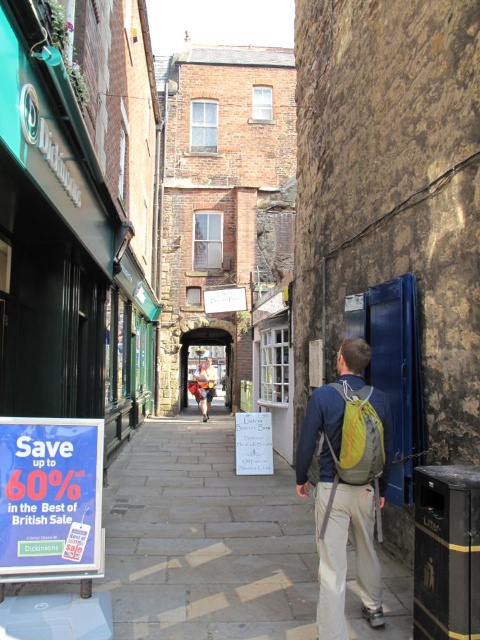
Is blue paper sign at lower left bigger than camouflage shorts at center?

No, blue paper sign at lower left is not bigger than camouflage shorts at center.

Measure the distance between blue paper sign at lower left and camouflage shorts at center.

blue paper sign at lower left and camouflage shorts at center are 52.81 feet apart.

Image resolution: width=480 pixels, height=640 pixels. I want to click on blue paper sign at lower left, so click(x=50, y=497).

Looking at this image, does green fabric backpack at center have a greater height compared to camouflage shorts at center?

Yes, green fabric backpack at center is taller than camouflage shorts at center.

Which is more to the left, green fabric backpack at center or camouflage shorts at center?

Positioned to the left is camouflage shorts at center.

Which is in front, point (311, 448) or point (204, 394)?

Positioned in front is point (311, 448).

Identify the location of green fabric backpack at center. The height and width of the screenshot is (640, 480). (345, 486).

Is paved stone pavement at lower center positioned behind camouflage shorts at center?

No.

Is paved stone pavement at lower center shorter than camouflage shorts at center?

Correct, paved stone pavement at lower center is not as tall as camouflage shorts at center.

Who is more forward, (x=173, y=472) or (x=207, y=376)?

Positioned in front is point (x=173, y=472).

At what (x,y) coordinates should I click in order to perform the action: click on paved stone pavement at lower center. Please return your answer as a coordinate pair (x, y). The height and width of the screenshot is (640, 480). Looking at the image, I should click on (188, 548).